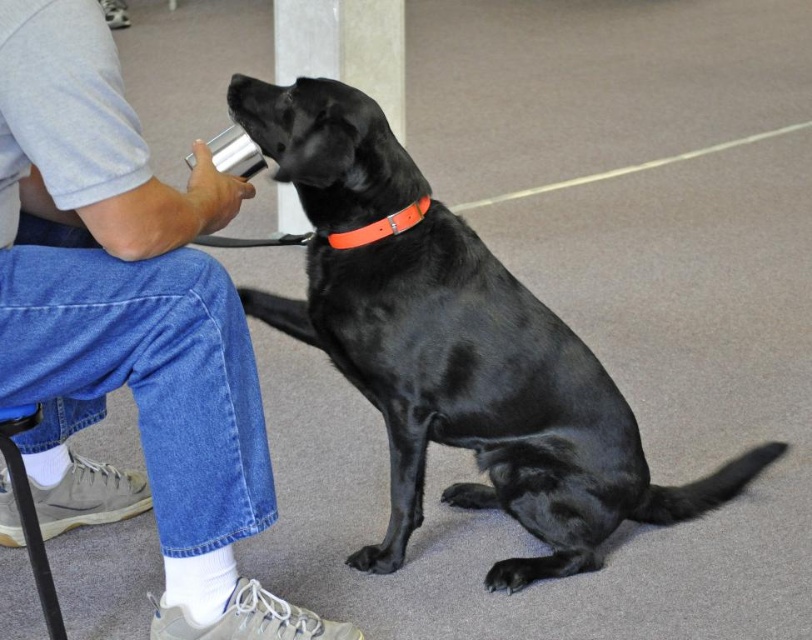
Question: Which object appears closest to the camera in this image?

Choices:
 (A) gray cotton shirt at upper left
 (B) black smooth dog at center

Answer: (A)

Question: Does gray cotton shirt at upper left appear on the right side of black smooth dog at center?

Choices:
 (A) yes
 (B) no

Answer: (B)

Question: Does gray cotton shirt at upper left have a smaller size compared to black smooth dog at center?

Choices:
 (A) yes
 (B) no

Answer: (A)

Question: Is gray cotton shirt at upper left to the left of black smooth dog at center from the viewer's perspective?

Choices:
 (A) yes
 (B) no

Answer: (A)

Question: Which object is closer to the camera taking this photo?

Choices:
 (A) black smooth dog at center
 (B) gray cotton shirt at upper left

Answer: (B)

Question: Among these points, which one is farthest from the camera?

Choices:
 (A) (13, 4)
 (B) (568, 440)

Answer: (B)